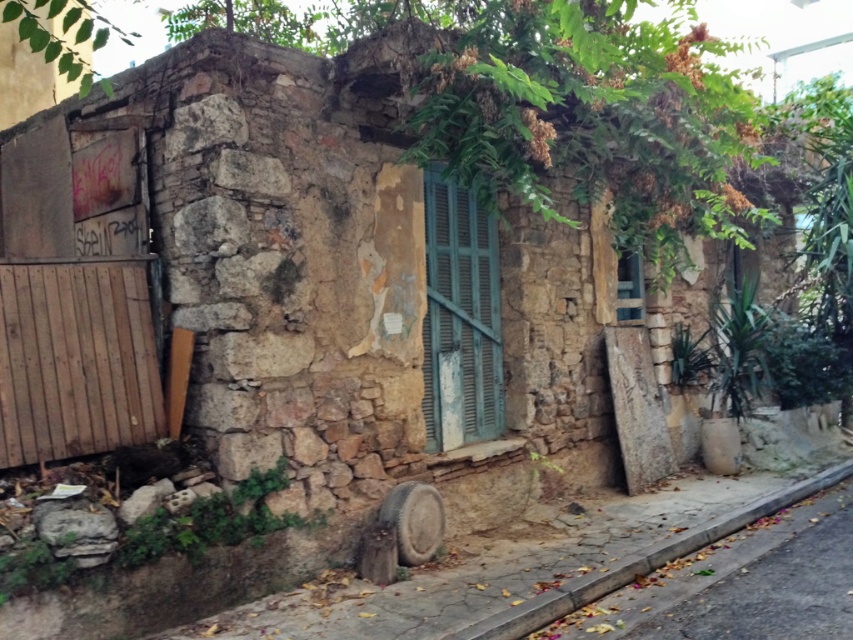
Does green painted wood shutter at center have a greater height compared to gray concrete curb at lower right?

Yes.

Does green painted wood shutter at center appear over gray concrete curb at lower right?

Indeed, green painted wood shutter at center is positioned over gray concrete curb at lower right.

The height and width of the screenshot is (640, 853). What do you see at coordinates (460, 317) in the screenshot?
I see `green painted wood shutter at center` at bounding box center [460, 317].

Locate an element on the screen. green painted wood shutter at center is located at coordinates (460, 317).